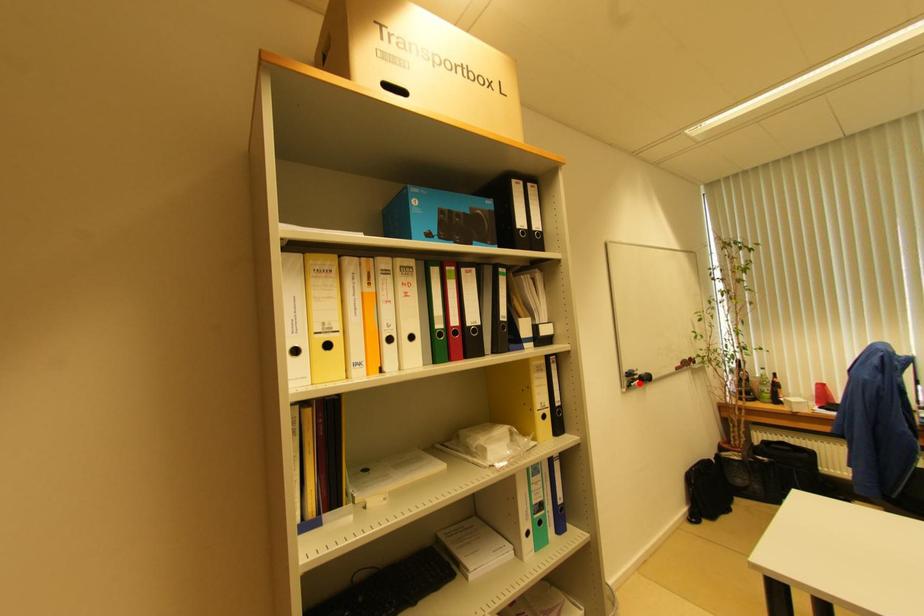
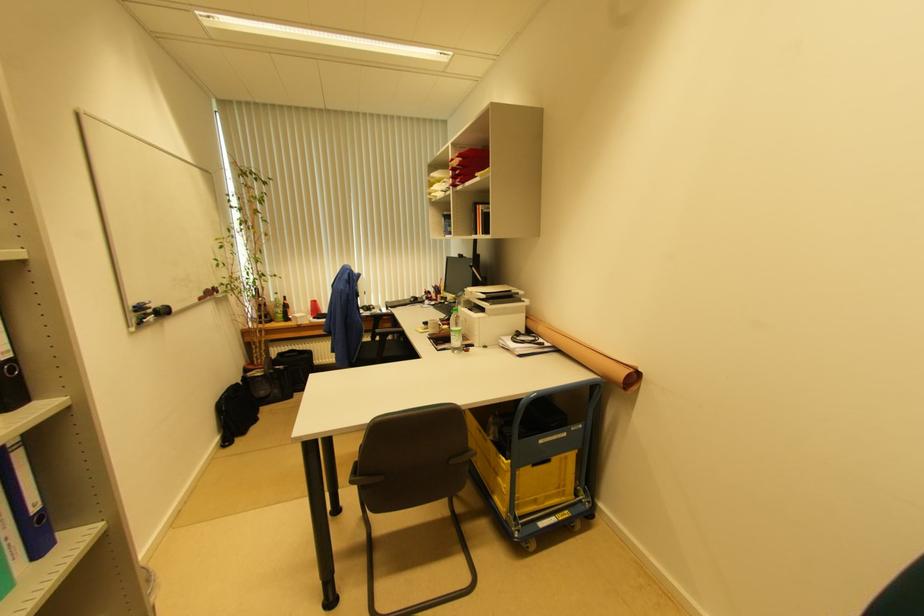
Find the pixel in the second image that matches the highlighted location in the first image.

(154, 318)